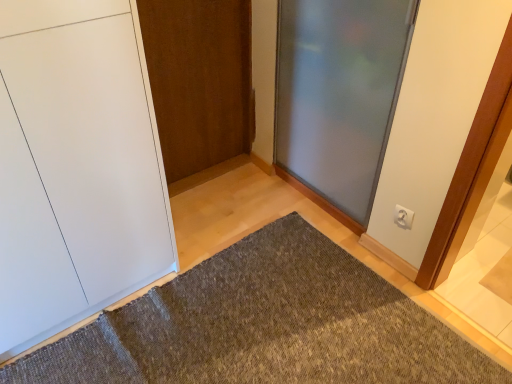
You are a GUI agent. You are given a task and a screenshot of the screen. Output one action in this format:
    pyautogui.click(x=<x>, y=<y>)
    Task: Click on the wooden door at center, which appears as the second door when viewed from the left
    The height and width of the screenshot is (384, 512).
    Given the screenshot: What is the action you would take?
    pyautogui.click(x=199, y=80)

The image size is (512, 384). What do you see at coordinates (199, 80) in the screenshot?
I see `wooden door at center, which is counted as the 2th door, starting from the right` at bounding box center [199, 80].

The width and height of the screenshot is (512, 384). What do you see at coordinates (339, 94) in the screenshot?
I see `frosted glass door at center, which appears as the 3th door when viewed from the left` at bounding box center [339, 94].

What do you see at coordinates (265, 326) in the screenshot? I see `textured gray doormat at center` at bounding box center [265, 326].

At what (x,y) coordinates should I click in order to perform the action: click on white plastic electric outlet at upper right. Please return your answer as a coordinate pair (x, y). This screenshot has width=512, height=384. Looking at the image, I should click on (403, 217).

Considering the positions of objects wooden door at center, which appears as the second door when viewed from the left, and white plastic electric outlet at upper right in the image provided, who is behind, wooden door at center, which appears as the second door when viewed from the left, or white plastic electric outlet at upper right?

wooden door at center, which appears as the second door when viewed from the left, is behind.

This screenshot has height=384, width=512. In order to click on door that appears behind the white plastic electric outlet at upper right in this screenshot , I will do `click(199, 80)`.

Is wooden door at center, which appears as the second door when viewed from the left, not inside white plastic electric outlet at upper right?

Indeed, wooden door at center, which appears as the second door when viewed from the left, is completely outside white plastic electric outlet at upper right.

From a real-world perspective, between white matte door at left, which is the first door in left-to-right order, and textured gray doormat at center, who is vertically higher?

In real-world perspective, white matte door at left, which is the first door in left-to-right order, is above.

From the image's perspective, which object appears higher, white matte door at left, which is the first door in left-to-right order, or textured gray doormat at center?

white matte door at left, which is the first door in left-to-right order.

Consider the image. How distant is white matte door at left, which appears as the 3th door when viewed from the right, from textured gray doormat at center?

white matte door at left, which appears as the 3th door when viewed from the right, is 21.39 inches away from textured gray doormat at center.

Which is closer, (47, 118) or (241, 280)?

Point (47, 118) is positioned closer to the camera compared to point (241, 280).

From the image's perspective, which one is positioned higher, white plastic electric outlet at upper right or textured gray doormat at center?

white plastic electric outlet at upper right.

Looking at the image, does white plastic electric outlet at upper right seem bigger or smaller compared to textured gray doormat at center?

white plastic electric outlet at upper right is smaller than textured gray doormat at center.

Looking at this image, from a real-world perspective, relative to textured gray doormat at center, is white plastic electric outlet at upper right vertically above or below?

In terms of real-world spatial position, white plastic electric outlet at upper right is above textured gray doormat at center.

Looking at this image, considering the relative positions of wooden door at center, which is counted as the 2th door, starting from the right, and white matte door at left, which is the first door in left-to-right order, in the image provided, is wooden door at center, which is counted as the 2th door, starting from the right, to the right of white matte door at left, which is the first door in left-to-right order, from the viewer's perspective?

Indeed, wooden door at center, which is counted as the 2th door, starting from the right, is positioned on the right side of white matte door at left, which is the first door in left-to-right order.

Is wooden door at center, which appears as the second door when viewed from the left, shorter than white matte door at left, which is the first door in left-to-right order?

Yes.

Can you confirm if wooden door at center, which appears as the second door when viewed from the left, is smaller than white matte door at left, which appears as the 3th door when viewed from the right?

Correct, wooden door at center, which appears as the second door when viewed from the left, occupies less space than white matte door at left, which appears as the 3th door when viewed from the right.

Relative to white matte door at left, which is the first door in left-to-right order, is wooden door at center, which appears as the second door when viewed from the left, in front or behind?

In the image, wooden door at center, which appears as the second door when viewed from the left, appears behind white matte door at left, which is the first door in left-to-right order.

The width and height of the screenshot is (512, 384). Identify the location of door below the frosted glass door at center, which is the 1th door in right-to-left order (from the image's perspective). (77, 166).

Can you tell me how much frosted glass door at center, which is the 1th door in right-to-left order, and white matte door at left, which is the first door in left-to-right order, differ in facing direction?

The facing directions of frosted glass door at center, which is the 1th door in right-to-left order, and white matte door at left, which is the first door in left-to-right order, are 90.8 degrees apart.

Which point is more distant from viewer, (377, 172) or (78, 62)?

The point (377, 172) is more distant.

Considering the sizes of objects frosted glass door at center, which appears as the 3th door when viewed from the left, and white matte door at left, which is the first door in left-to-right order, in the image provided, who is thinner, frosted glass door at center, which appears as the 3th door when viewed from the left, or white matte door at left, which is the first door in left-to-right order,?

With smaller width is frosted glass door at center, which appears as the 3th door when viewed from the left.

Could you tell me if textured gray doormat at center is turned towards wooden door at center, which appears as the second door when viewed from the left?

No, textured gray doormat at center is not turned towards wooden door at center, which appears as the second door when viewed from the left.

Does point (63, 372) appear closer or farther from the camera than point (208, 3)?

Point (63, 372).

Considering the sizes of objects textured gray doormat at center and wooden door at center, which is counted as the 2th door, starting from the right, in the image provided, who is bigger, textured gray doormat at center or wooden door at center, which is counted as the 2th door, starting from the right,?

Bigger between the two is textured gray doormat at center.

Which is more to the right, textured gray doormat at center or wooden door at center, which is counted as the 2th door, starting from the right?

textured gray doormat at center.

Which is farther from the camera, (238, 249) or (344, 63)?

The point (238, 249) is behind.

From the picture: Between textured gray doormat at center and frosted glass door at center, which appears as the 3th door when viewed from the left, which one has smaller width?

frosted glass door at center, which appears as the 3th door when viewed from the left.

Is textured gray doormat at center next to frosted glass door at center, which is the 1th door in right-to-left order, and touching it?

No, textured gray doormat at center is not next to frosted glass door at center, which is the 1th door in right-to-left order.

In order to click on electric outlet in front of the wooden door at center, which is counted as the 2th door, starting from the right in this screenshot , I will do `click(403, 217)`.

Locate an element on the screen. The image size is (512, 384). door that is the 1st object located above the textured gray doormat at center (from the image's perspective) is located at coordinates pos(77,166).

Estimate the real-world distances between objects in this image. Which object is further from textured gray doormat at center, white matte door at left, which appears as the 3th door when viewed from the right, or frosted glass door at center, which appears as the 3th door when viewed from the left?

frosted glass door at center, which appears as the 3th door when viewed from the left, is positioned further to the anchor textured gray doormat at center.

Which object lies further to the anchor point white matte door at left, which appears as the 3th door when viewed from the right, wooden door at center, which appears as the second door when viewed from the left, or textured gray doormat at center?

wooden door at center, which appears as the second door when viewed from the left.

Considering their positions, is white plastic electric outlet at upper right positioned closer to white matte door at left, which appears as the 3th door when viewed from the right, than wooden door at center, which is counted as the 2th door, starting from the right?

wooden door at center, which is counted as the 2th door, starting from the right.

Considering their positions, is white plastic electric outlet at upper right positioned further to textured gray doormat at center than frosted glass door at center, which is the 1th door in right-to-left order?

frosted glass door at center, which is the 1th door in right-to-left order, is positioned further to the anchor textured gray doormat at center.

Which object lies nearer to the anchor point textured gray doormat at center, wooden door at center, which appears as the second door when viewed from the left, or white plastic electric outlet at upper right?

white plastic electric outlet at upper right.

Estimate the real-world distances between objects in this image. Which object is closer to white matte door at left, which is the first door in left-to-right order, textured gray doormat at center or wooden door at center, which appears as the second door when viewed from the left?

textured gray doormat at center.

Estimate the real-world distances between objects in this image. Which object is closer to white plastic electric outlet at upper right, white matte door at left, which is the first door in left-to-right order, or frosted glass door at center, which is the 1th door in right-to-left order?

The object closer to white plastic electric outlet at upper right is frosted glass door at center, which is the 1th door in right-to-left order.

Based on their spatial positions, is wooden door at center, which is counted as the 2th door, starting from the right, or white matte door at left, which appears as the 3th door when viewed from the right, further from frosted glass door at center, which is the 1th door in right-to-left order?

Among the two, white matte door at left, which appears as the 3th door when viewed from the right, is located further to frosted glass door at center, which is the 1th door in right-to-left order.

At what (x,y) coordinates should I click in order to perform the action: click on door between white matte door at left, which appears as the 3th door when viewed from the right, and frosted glass door at center, which is the 1th door in right-to-left order, in the horizontal direction. Please return your answer as a coordinate pair (x, y). The height and width of the screenshot is (384, 512). Looking at the image, I should click on 199,80.

The height and width of the screenshot is (384, 512). Find the location of `electric outlet between frosted glass door at center, which appears as the 3th door when viewed from the left, and textured gray doormat at center, in the vertical direction`. electric outlet between frosted glass door at center, which appears as the 3th door when viewed from the left, and textured gray doormat at center, in the vertical direction is located at coordinates (403, 217).

Identify the location of doormat situated between white matte door at left, which is the first door in left-to-right order, and frosted glass door at center, which appears as the 3th door when viewed from the left, from left to right. (265, 326).

The height and width of the screenshot is (384, 512). Identify the location of door between wooden door at center, which is counted as the 2th door, starting from the right, and white plastic electric outlet at upper right, in the horizontal direction. (339, 94).